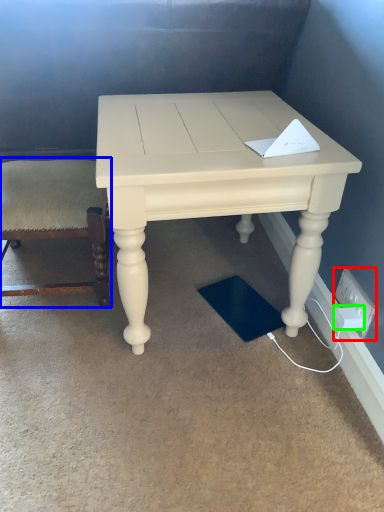
Question: Which object is the farthest from electric outlet (highlighted by a red box)? Choose among these: chair (highlighted by a blue box) or socket (highlighted by a green box).

Choices:
 (A) chair
 (B) socket

Answer: (A)